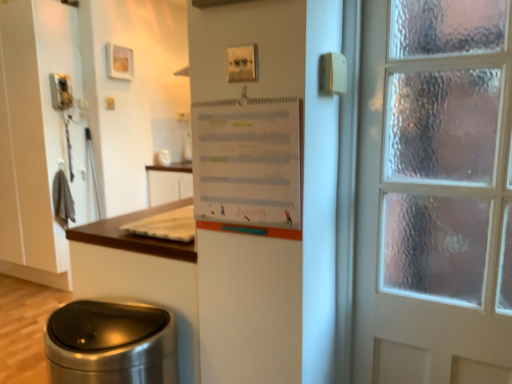
Question: In terms of height, does polished stainless steel trash can at lower left look taller or shorter compared to white paper at upper center?

Choices:
 (A) short
 (B) tall

Answer: (B)

Question: Is polished stainless steel trash can at lower left in front of or behind white paper at upper center in the image?

Choices:
 (A) front
 (B) behind

Answer: (B)

Question: From the image's perspective, is polished stainless steel trash can at lower left positioned above or below white paper at upper center?

Choices:
 (A) below
 (B) above

Answer: (A)

Question: Is point [276, 117] positioned closer to the camera than point [103, 347]?

Choices:
 (A) farther
 (B) closer

Answer: (B)

Question: From a real-world perspective, is white paper at upper center positioned above or below polished stainless steel trash can at lower left?

Choices:
 (A) below
 (B) above

Answer: (B)

Question: In terms of width, does white paper at upper center look wider or thinner when compared to polished stainless steel trash can at lower left?

Choices:
 (A) wide
 (B) thin

Answer: (B)

Question: Considering the relative positions of white paper at upper center and polished stainless steel trash can at lower left in the image provided, is white paper at upper center to the left or to the right of polished stainless steel trash can at lower left?

Choices:
 (A) right
 (B) left

Answer: (A)